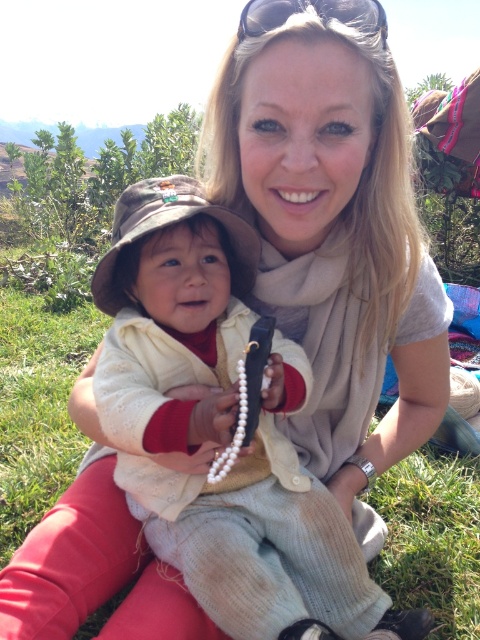
Can you confirm if knitted beige sweater at center is positioned to the right of black plastic sunglasses at upper center?

In fact, knitted beige sweater at center is to the left of black plastic sunglasses at upper center.

Consider the image. Which is above, knitted beige sweater at center or black plastic sunglasses at upper center?

black plastic sunglasses at upper center is higher up.

The width and height of the screenshot is (480, 640). Describe the element at coordinates (219, 428) in the screenshot. I see `knitted beige sweater at center` at that location.

The width and height of the screenshot is (480, 640). Find the location of `knitted beige sweater at center`. knitted beige sweater at center is located at coordinates tap(219, 428).